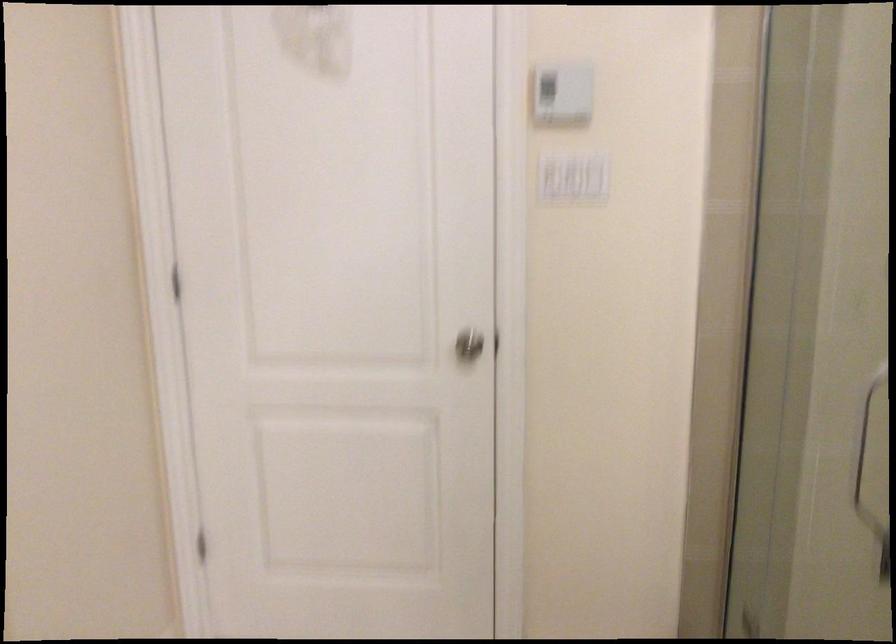
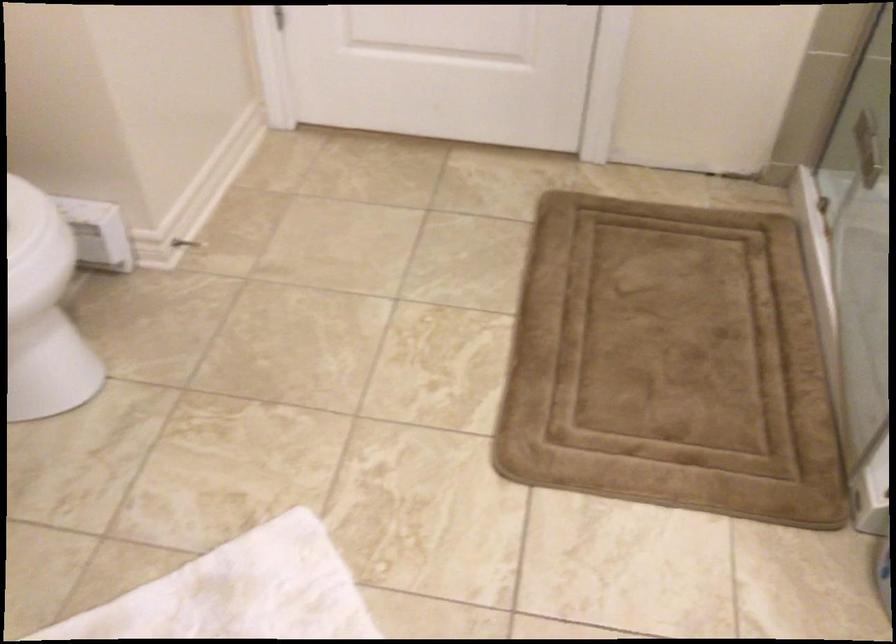
In the second image, find the point that corresponds to point 193,509 in the first image.

(274, 17)